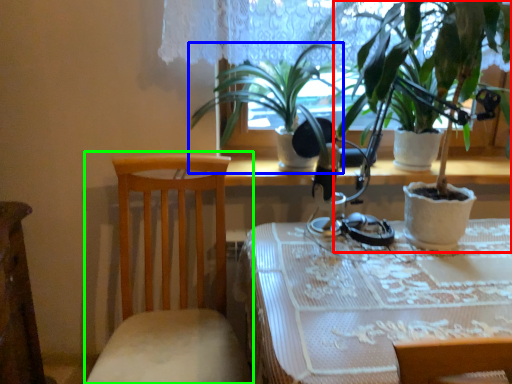
Question: Considering the real-world distances, which object is farthest from houseplant (highlighted by a red box)? houseplant (highlighted by a blue box) or chair (highlighted by a green box)?

Choices:
 (A) houseplant
 (B) chair

Answer: (B)